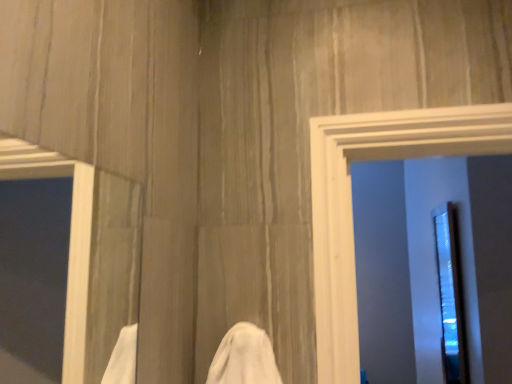
At what (x,y) coordinates should I click in order to perform the action: click on white matte frame at left. Please return your answer as a coordinate pair (x, y). Image resolution: width=512 pixels, height=384 pixels. Looking at the image, I should click on (90, 254).

Describe the element at coordinates (90, 254) in the screenshot. I see `white matte frame at left` at that location.

Where is `transparent plastic screen door at right`? Image resolution: width=512 pixels, height=384 pixels. transparent plastic screen door at right is located at coordinates (450, 295).

Describe the element at coordinates (450, 295) in the screenshot. I see `transparent plastic screen door at right` at that location.

Locate an element on the screen. The image size is (512, 384). white matte frame at left is located at coordinates (90, 254).

In the scene shown: Can you confirm if transparent plastic screen door at right is positioned to the left of white matte frame at left?

In fact, transparent plastic screen door at right is to the right of white matte frame at left.

Considering their positions, is transparent plastic screen door at right located in front of or behind white matte frame at left?

transparent plastic screen door at right is behind white matte frame at left.

Is point (443, 323) closer or farther from the camera than point (83, 358)?

Clearly, point (443, 323) is more distant from the camera than point (83, 358).

From the image's perspective, would you say transparent plastic screen door at right is shown under white matte frame at left?

Indeed, from the image's perspective, transparent plastic screen door at right is shown beneath white matte frame at left.

From a real-world perspective, is transparent plastic screen door at right located higher than white matte frame at left?

No, from a real-world perspective, transparent plastic screen door at right is not over white matte frame at left

Considering the sizes of transparent plastic screen door at right and white matte frame at left in the image, is transparent plastic screen door at right wider or thinner than white matte frame at left?

Considering their sizes, transparent plastic screen door at right looks broader than white matte frame at left.

In terms of height, does transparent plastic screen door at right look taller or shorter compared to white matte frame at left?

transparent plastic screen door at right is taller than white matte frame at left.

Is transparent plastic screen door at right bigger or smaller than white matte frame at left?

Clearly, transparent plastic screen door at right is larger in size than white matte frame at left.

Which is correct: transparent plastic screen door at right is inside white matte frame at left, or outside of it?

transparent plastic screen door at right is spatially situated outside white matte frame at left.

Is transparent plastic screen door at right not near white matte frame at left?

transparent plastic screen door at right is far away from white matte frame at left.

Could you tell me if transparent plastic screen door at right is turned towards white matte frame at left?

No.

How different are the orientations of transparent plastic screen door at right and white matte frame at left in degrees?

179 degrees.

Locate an element on the screen. Image resolution: width=512 pixels, height=384 pixels. screen door that is behind the white matte frame at left is located at coordinates (450, 295).

Considering the relative positions of white matte frame at left and transparent plastic screen door at right in the image provided, is white matte frame at left to the left or to the right of transparent plastic screen door at right?

From the image, it's evident that white matte frame at left is to the left of transparent plastic screen door at right.

Considering the positions of objects white matte frame at left and transparent plastic screen door at right in the image provided, who is behind, white matte frame at left or transparent plastic screen door at right?

transparent plastic screen door at right is further away from the camera.

Considering the positions of points (88, 194) and (447, 229), is point (88, 194) closer to camera compared to point (447, 229)?

That is True.

From the image's perspective, which object appears higher, white matte frame at left or transparent plastic screen door at right?

white matte frame at left is shown above in the image.

From a real-world perspective, between white matte frame at left and transparent plastic screen door at right, who is vertically lower?

transparent plastic screen door at right.

Which object is wider, white matte frame at left or transparent plastic screen door at right?

With larger width is transparent plastic screen door at right.

In the scene shown: Between white matte frame at left and transparent plastic screen door at right, which one has more height?

With more height is transparent plastic screen door at right.

Considering the sizes of objects white matte frame at left and transparent plastic screen door at right in the image provided, who is bigger, white matte frame at left or transparent plastic screen door at right?

transparent plastic screen door at right is bigger.

Is white matte frame at left inside or outside of transparent plastic screen door at right?

white matte frame at left cannot be found inside transparent plastic screen door at right.

Is white matte frame at left not near transparent plastic screen door at right?

white matte frame at left is far away from transparent plastic screen door at right.

Is white matte frame at left turned away from transparent plastic screen door at right?

white matte frame at left does not have its back to transparent plastic screen door at right.

Where is `screen door located underneath the white matte frame at left (from a real-world perspective)`? Image resolution: width=512 pixels, height=384 pixels. screen door located underneath the white matte frame at left (from a real-world perspective) is located at coordinates (450, 295).

Identify the location of screen door that appears on the right of white matte frame at left. (450, 295).

Locate an element on the screen. This screenshot has height=384, width=512. window above the transparent plastic screen door at right (from a real-world perspective) is located at coordinates (90, 254).